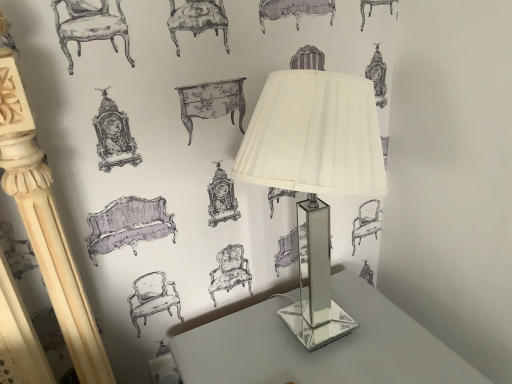
Question: Considering the relative positions of clear glass lamp at center and clear glass table at center in the image provided, is clear glass lamp at center to the right of clear glass table at center from the viewer's perspective?

Choices:
 (A) yes
 (B) no

Answer: (B)

Question: Would you say clear glass lamp at center is a long distance from clear glass table at center?

Choices:
 (A) no
 (B) yes

Answer: (A)

Question: From the image's perspective, is clear glass lamp at center on clear glass table at center?

Choices:
 (A) no
 (B) yes

Answer: (B)

Question: From a real-world perspective, is clear glass lamp at center under clear glass table at center?

Choices:
 (A) yes
 (B) no

Answer: (B)

Question: Is clear glass lamp at center bigger than clear glass table at center?

Choices:
 (A) no
 (B) yes

Answer: (A)

Question: Is clear glass lamp at center next to clear glass table at center?

Choices:
 (A) yes
 (B) no

Answer: (A)

Question: Considering the relative sizes of clear glass table at center and clear glass lamp at center in the image provided, is clear glass table at center wider than clear glass lamp at center?

Choices:
 (A) yes
 (B) no

Answer: (A)

Question: Does clear glass table at center come in front of clear glass lamp at center?

Choices:
 (A) yes
 (B) no

Answer: (B)

Question: Considering the relative positions of clear glass table at center and clear glass lamp at center in the image provided, is clear glass table at center to the right of clear glass lamp at center from the viewer's perspective?

Choices:
 (A) no
 (B) yes

Answer: (B)

Question: From the image's perspective, is clear glass table at center on top of clear glass lamp at center?

Choices:
 (A) yes
 (B) no

Answer: (B)

Question: Considering the relative positions of clear glass table at center and clear glass lamp at center in the image provided, is clear glass table at center behind clear glass lamp at center?

Choices:
 (A) yes
 (B) no

Answer: (A)

Question: Is clear glass table at center oriented away from clear glass lamp at center?

Choices:
 (A) yes
 (B) no

Answer: (B)

Question: From a real-world perspective, relative to clear glass lamp at center, is clear glass table at center vertically above or below?

Choices:
 (A) above
 (B) below

Answer: (B)